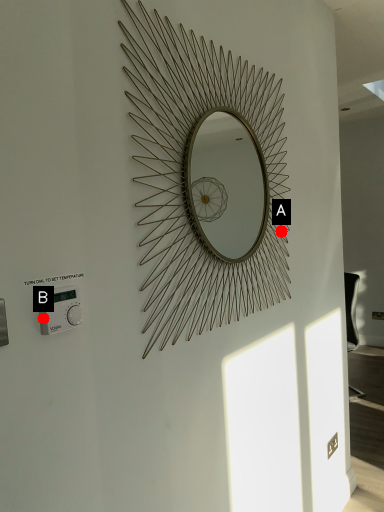
Question: Two points are circled on the image, labeled by A and B beside each circle. Which point is farther to the camera?

Choices:
 (A) A is further
 (B) B is further

Answer: (A)